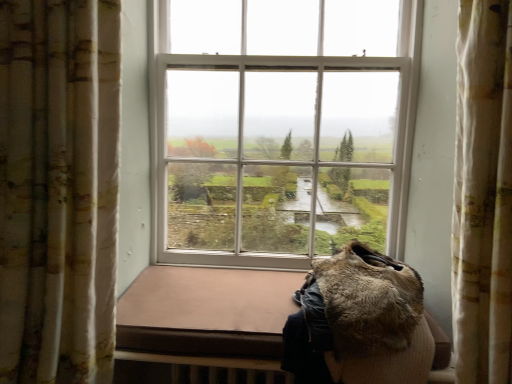
Where is `fluffy fabric curtain at left`? The image size is (512, 384). fluffy fabric curtain at left is located at coordinates (58, 189).

Describe the element at coordinates (58, 189) in the screenshot. This screenshot has width=512, height=384. I see `fluffy fabric curtain at left` at that location.

This screenshot has height=384, width=512. What do you see at coordinates (356, 318) in the screenshot?
I see `furry brown coat at lower right` at bounding box center [356, 318].

The width and height of the screenshot is (512, 384). In order to click on furry brown coat at lower right in this screenshot , I will do `click(356, 318)`.

Measure the distance between point (309, 306) and camera.

They are 1.13 meters apart.

At what (x,y) coordinates should I click in order to perform the action: click on fluffy fabric curtain at left. Please return your answer as a coordinate pair (x, y). Image resolution: width=512 pixels, height=384 pixels. Looking at the image, I should click on (58, 189).

Considering the positions of objects furry brown coat at lower right and fluffy fabric curtain at left in the image provided, who is more to the left, furry brown coat at lower right or fluffy fabric curtain at left?

fluffy fabric curtain at left.

In the image, is furry brown coat at lower right positioned in front of or behind fluffy fabric curtain at left?

furry brown coat at lower right is positioned farther from the viewer than fluffy fabric curtain at left.

Does point (371, 302) lie behind point (83, 380)?

No, it is in front of (83, 380).

From the image's perspective, is furry brown coat at lower right over fluffy fabric curtain at left?

Incorrect, from the image's perspective, furry brown coat at lower right is lower than fluffy fabric curtain at left.

From a real-world perspective, who is located higher, furry brown coat at lower right or fluffy fabric curtain at left?

In real-world perspective, fluffy fabric curtain at left is above.

Considering the relative sizes of furry brown coat at lower right and fluffy fabric curtain at left in the image provided, is furry brown coat at lower right wider than fluffy fabric curtain at left?

Correct, the width of furry brown coat at lower right exceeds that of fluffy fabric curtain at left.

Between furry brown coat at lower right and fluffy fabric curtain at left, which one has more height?

fluffy fabric curtain at left is taller.

Considering the sizes of objects furry brown coat at lower right and fluffy fabric curtain at left in the image provided, who is bigger, furry brown coat at lower right or fluffy fabric curtain at left?

fluffy fabric curtain at left.

Looking at this image, is furry brown coat at lower right inside or outside of fluffy fabric curtain at left?

furry brown coat at lower right lies outside fluffy fabric curtain at left.

Would you consider furry brown coat at lower right to be distant from fluffy fabric curtain at left?

No, furry brown coat at lower right is not far from fluffy fabric curtain at left.

Does furry brown coat at lower right turn towards fluffy fabric curtain at left?

No.

Where is `curtain that is in front of the furry brown coat at lower right`? This screenshot has height=384, width=512. curtain that is in front of the furry brown coat at lower right is located at coordinates (58, 189).

Between fluffy fabric curtain at left and furry brown coat at lower right, which one appears on the right side from the viewer's perspective?

furry brown coat at lower right.

Which object is closer to the camera taking this photo, fluffy fabric curtain at left or furry brown coat at lower right?

Positioned in front is fluffy fabric curtain at left.

Is point (0, 148) positioned behind point (406, 333)?

No, (0, 148) is closer to viewer.

From the image's perspective, who appears lower, fluffy fabric curtain at left or furry brown coat at lower right?

From the image's view, furry brown coat at lower right is below.

From a real-world perspective, which is physically above, fluffy fabric curtain at left or furry brown coat at lower right?

fluffy fabric curtain at left.

Considering the sizes of objects fluffy fabric curtain at left and furry brown coat at lower right in the image provided, who is thinner, fluffy fabric curtain at left or furry brown coat at lower right?

fluffy fabric curtain at left is thinner.

Can you confirm if fluffy fabric curtain at left is shorter than furry brown coat at lower right?

Incorrect, the height of fluffy fabric curtain at left does not fall short of that of furry brown coat at lower right.

Considering the relative sizes of fluffy fabric curtain at left and furry brown coat at lower right in the image provided, is fluffy fabric curtain at left bigger than furry brown coat at lower right?

Indeed, fluffy fabric curtain at left has a larger size compared to furry brown coat at lower right.

Is fluffy fabric curtain at left surrounding furry brown coat at lower right?

No, fluffy fabric curtain at left does not contain furry brown coat at lower right.

Are fluffy fabric curtain at left and furry brown coat at lower right located far from each other?

They are positioned close to each other.

Could you tell me if fluffy fabric curtain at left is facing furry brown coat at lower right?

No, fluffy fabric curtain at left is not turned towards furry brown coat at lower right.

How many degrees apart are the facing directions of fluffy fabric curtain at left and furry brown coat at lower right?

The angular difference between fluffy fabric curtain at left and furry brown coat at lower right is 3.32 degrees.

How far apart are fluffy fabric curtain at left and furry brown coat at lower right?

They are 26.52 inches apart.

The image size is (512, 384). In order to click on animal located behind the fluffy fabric curtain at left in this screenshot , I will do `click(356, 318)`.

There is a furry brown coat at lower right. Where is `curtain above it (from a real-world perspective)`? Image resolution: width=512 pixels, height=384 pixels. curtain above it (from a real-world perspective) is located at coordinates (58, 189).

At what (x,y) coordinates should I click in order to perform the action: click on animal on the right of fluffy fabric curtain at left. Please return your answer as a coordinate pair (x, y). Looking at the image, I should click on (356, 318).